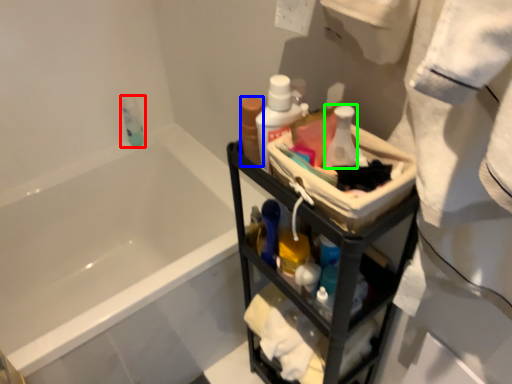
Question: Estimate the real-world distances between objects in this image. Which object is farther from mouthwash (highlighted by a red box), mouthwash (highlighted by a blue box) or toiletry (highlighted by a green box)?

Choices:
 (A) mouthwash
 (B) toiletry

Answer: (B)